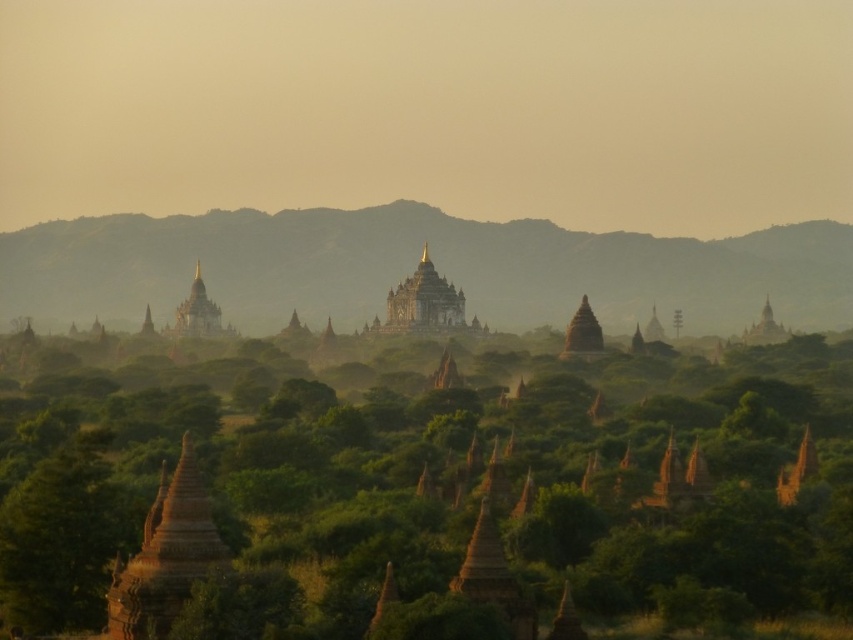
You are a tourist standing in the Bagan archaeological zone and want to take a photo that includes both the brown textured stupa at center and the golden stone temple at center. Which object should you position closer to the edge of the frame to ensure both fit in the shot?

The brown textured stupa at center might be wider than the golden stone temple at center, so positioning the wider stupa closer to the edge of the frame would allow both to fit better in the photo.